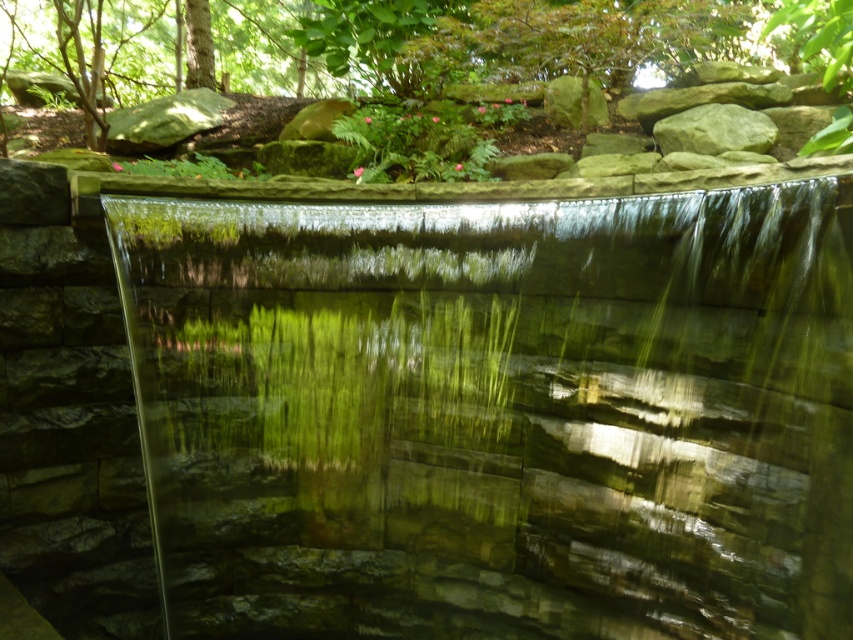
You are standing in the serene outdoor scene with a transparent glass waterfall at center. You want to place a small decorative statue exactly at point (497, 413). Is this point located on the transparent glass waterfall at center?

Yes, the point (497, 413) is on the transparent glass waterfall at center, so placing the statue there would position it directly on the waterfall.

You are designing a miniature landscape and need to place the transparent glass waterfall at center and the green rough stone at upper right. Given their sizes, which object will occupy more horizontal space in the layout?

The transparent glass waterfall at center will occupy more horizontal space in the layout because its width is larger than the green rough stone at upper right.